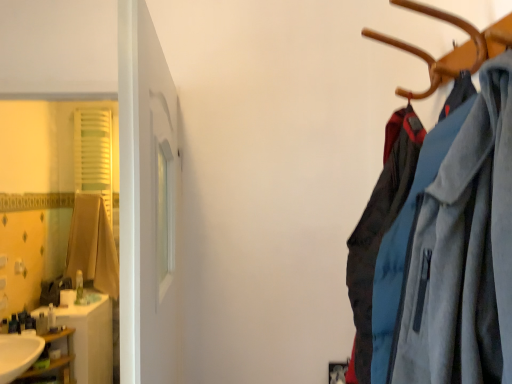
Question: From the image's perspective, does white glossy sink at lower left appear higher than translucent plastic soap at left, acting as the third toiletry starting from the front?

Choices:
 (A) no
 (B) yes

Answer: (A)

Question: Does white glossy sink at lower left lie in front of translucent plastic soap at left, acting as the 3th toiletry starting from the back?

Choices:
 (A) no
 (B) yes

Answer: (B)

Question: Is white glossy sink at lower left not within translucent plastic soap at left, which is the 4th toiletry from right to left?

Choices:
 (A) yes
 (B) no

Answer: (A)

Question: Is white glossy sink at lower left surrounding translucent plastic soap at left, acting as the 3th toiletry starting from the back?

Choices:
 (A) no
 (B) yes

Answer: (A)

Question: From the image's perspective, is white glossy sink at lower left beneath translucent plastic soap at left, which is the 4th toiletry from right to left?

Choices:
 (A) no
 (B) yes

Answer: (B)

Question: Choose the correct answer: Is wooden shelf at lower left inside translucent plastic soap at left, marked as the first toiletry in a left-to-right arrangement, or outside it?

Choices:
 (A) inside
 (B) outside

Answer: (B)

Question: From a real-world perspective, is wooden shelf at lower left above or below translucent plastic soap at left, marked as the 5th toiletry in a back-to-front arrangement?

Choices:
 (A) below
 (B) above

Answer: (A)

Question: Is wooden shelf at lower left bigger or smaller than translucent plastic soap at left, placed as the 1th toiletry when sorted from front to back?

Choices:
 (A) small
 (B) big

Answer: (B)

Question: Considering the positions of point (66, 357) and point (7, 329), is point (66, 357) closer or farther from the camera than point (7, 329)?

Choices:
 (A) closer
 (B) farther

Answer: (B)

Question: Considering their positions, is translucent plastic bottle at left, which is the 1th toiletry in right-to-left order, located in front of or behind white glossy sink at lower left?

Choices:
 (A) behind
 (B) front

Answer: (A)

Question: Is point (79, 292) positioned closer to the camera than point (26, 367)?

Choices:
 (A) farther
 (B) closer

Answer: (A)

Question: From a real-world perspective, is translucent plastic bottle at left, placed as the 5th toiletry when sorted from left to right, positioned above or below white glossy sink at lower left?

Choices:
 (A) above
 (B) below

Answer: (A)

Question: Considering the positions of translucent plastic bottle at left, which ranks as the 5th toiletry in front-to-back order, and white glossy sink at lower left in the image, is translucent plastic bottle at left, which ranks as the 5th toiletry in front-to-back order, wider or thinner than white glossy sink at lower left?

Choices:
 (A) wide
 (B) thin

Answer: (B)

Question: In the image, is matte brown cardigan at left positioned in front of or behind white glossy sink at lower left?

Choices:
 (A) behind
 (B) front

Answer: (A)

Question: Is point (86, 225) closer or farther from the camera than point (28, 337)?

Choices:
 (A) closer
 (B) farther

Answer: (B)